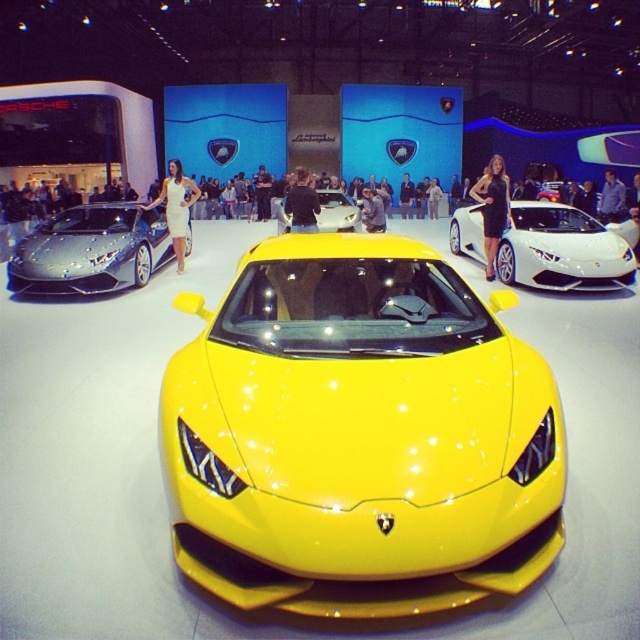
Can you confirm if shiny yellow sports car at center is positioned to the left of white dress at left?

In fact, shiny yellow sports car at center is to the right of white dress at left.

Is point (173, 524) in front of point (150, 205)?

Yes, point (173, 524) is closer to viewer.

Which is behind, point (444, 310) or point (188, 204)?

The point (188, 204) is behind.

Identify the location of shiny yellow sports car at center. tap(358, 435).

Where is `shiny yellow sports car at center`? This screenshot has height=640, width=640. shiny yellow sports car at center is located at coordinates click(x=358, y=435).

Between point (259, 404) and point (349, 228), which one is positioned behind?

The point (349, 228) is more distant.

What do you see at coordinates (358, 435) in the screenshot?
I see `shiny yellow sports car at center` at bounding box center [358, 435].

You are a GUI agent. You are given a task and a screenshot of the screen. Output one action in this format:
    pyautogui.click(x=<x>, y=<y>)
    Task: Click on the shiny yellow sports car at center
    This screenshot has width=640, height=640.
    Given the screenshot: What is the action you would take?
    pyautogui.click(x=358, y=435)

Who is more forward, (x=506, y=256) or (x=330, y=230)?

Point (x=506, y=256)

Can you confirm if white glossy sports car at center is positioned to the right of glossy white car at center?

Yes, white glossy sports car at center is to the right of glossy white car at center.

Which is behind, point (497, 273) or point (348, 198)?

The point (348, 198) is behind.

You are a GUI agent. You are given a task and a screenshot of the screen. Output one action in this format:
    pyautogui.click(x=<x>, y=<y>)
    Task: Click on the white glossy sports car at center
    The height and width of the screenshot is (640, 640).
    Given the screenshot: What is the action you would take?
    coord(561,250)